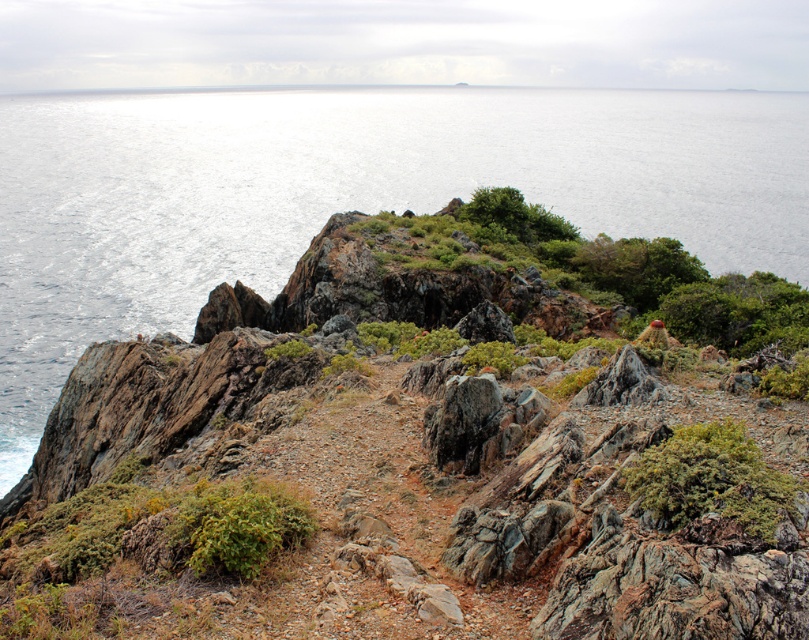
You are a hiker standing on the narrow dirt path in the rugged coastal landscape. You see the glistening silver water at upper left and the rusty metallic rock at center. Which object is closer to you?

The rusty metallic rock at center is behind the glistening silver water at upper left, so the glistening silver water at upper left is closer to you.

You are a hiker trying to navigate the rugged coastal path. You see the green fuzzy bush at center right and the rusty metallic rock at center. Which object is shorter in height?

The green fuzzy bush at center right is not as tall as the rusty metallic rock at center, so the green fuzzy bush at center right is shorter in height.

You are a hiker standing on the narrow dirt path in the rugged coastal landscape. You see the glistening silver water at upper left and the green fuzzy bush at center right. Which object is taller?

The glistening silver water at upper left is taller than the green fuzzy bush at center right according to the description.